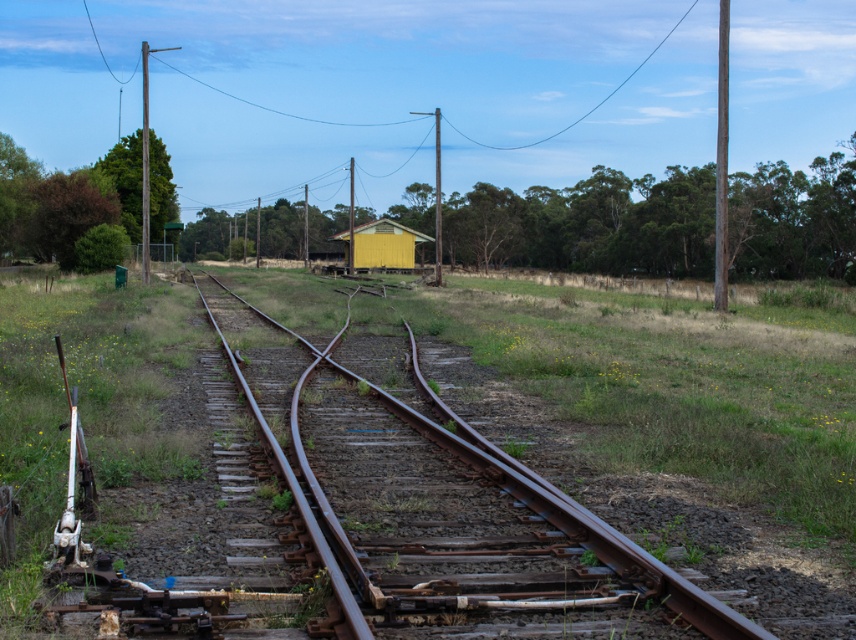
Can you confirm if rusty metal track at center is shorter than yellow wood hut at center?

Yes.

This screenshot has height=640, width=856. Describe the element at coordinates (571, 515) in the screenshot. I see `rusty metal track at center` at that location.

I want to click on rusty metal track at center, so click(x=571, y=515).